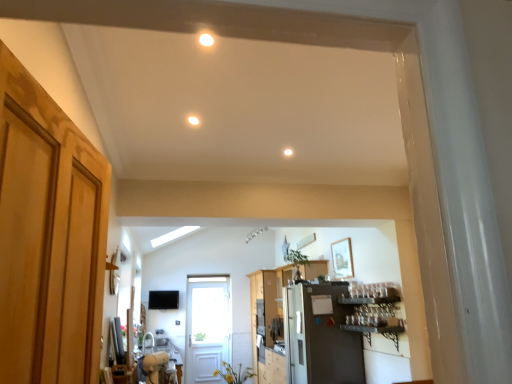
Question: Considering the relative sizes of metallic gray shelf at right and white glossy sink at lower left in the image provided, is metallic gray shelf at right wider than white glossy sink at lower left?

Choices:
 (A) no
 (B) yes

Answer: (B)

Question: Can you confirm if metallic gray shelf at right is shorter than white glossy sink at lower left?

Choices:
 (A) no
 (B) yes

Answer: (A)

Question: From a real-world perspective, is metallic gray shelf at right over white glossy sink at lower left?

Choices:
 (A) yes
 (B) no

Answer: (A)

Question: Would you say white glossy sink at lower left is part of metallic gray shelf at right's contents?

Choices:
 (A) yes
 (B) no

Answer: (B)

Question: Can you confirm if metallic gray shelf at right is thinner than white glossy sink at lower left?

Choices:
 (A) no
 (B) yes

Answer: (A)

Question: Is white glossy sink at lower left spatially inside wooden cabinet at center, or outside of it?

Choices:
 (A) outside
 (B) inside

Answer: (A)

Question: Is white glossy sink at lower left to the left or to the right of wooden cabinet at center in the image?

Choices:
 (A) left
 (B) right

Answer: (A)

Question: Considering the positions of white glossy sink at lower left and wooden cabinet at center in the image, is white glossy sink at lower left taller or shorter than wooden cabinet at center?

Choices:
 (A) short
 (B) tall

Answer: (A)

Question: Looking at the image, does white glossy sink at lower left seem bigger or smaller compared to wooden cabinet at center?

Choices:
 (A) small
 (B) big

Answer: (A)

Question: In terms of height, does white glossy sink at lower left look taller or shorter compared to satin silver refrigerator at center?

Choices:
 (A) short
 (B) tall

Answer: (A)

Question: Do you think white glossy sink at lower left is within satin silver refrigerator at center, or outside of it?

Choices:
 (A) outside
 (B) inside

Answer: (A)

Question: Considering the positions of point (165, 349) and point (303, 337), is point (165, 349) closer or farther from the camera than point (303, 337)?

Choices:
 (A) farther
 (B) closer

Answer: (A)

Question: Would you say white glossy sink at lower left is to the left or to the right of satin silver refrigerator at center in the picture?

Choices:
 (A) right
 (B) left

Answer: (B)

Question: Is white matte light fixture at center, the first lighting in the bottom-to-top sequence, in front of or behind matte white light fixture at center, arranged as the 2th lighting when viewed from the top, in the image?

Choices:
 (A) front
 (B) behind

Answer: (B)

Question: Is white matte light fixture at center, which is the first lighting in back-to-front order, inside or outside of matte white light fixture at center, positioned as the 2th lighting in bottom-to-top order?

Choices:
 (A) inside
 (B) outside

Answer: (B)